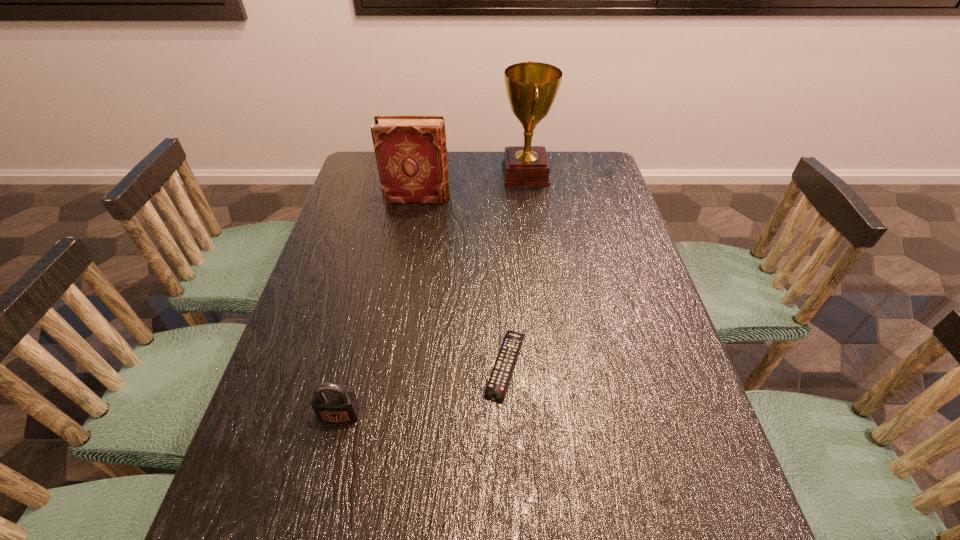
What are the coordinates of `free spot between the third farthest object and the padlock` in the screenshot? It's located at (422, 390).

Locate an element on the screen. This screenshot has height=540, width=960. empty space that is in between the second tallest object and the third farthest object is located at coordinates (462, 281).

The width and height of the screenshot is (960, 540). Find the location of `free spot between the nearest object and the shortest object`. free spot between the nearest object and the shortest object is located at coordinates (422, 390).

Where is `blank region between the award and the padlock`? This screenshot has height=540, width=960. blank region between the award and the padlock is located at coordinates (433, 294).

Where is `empty location between the hardback book and the shortest object`? This screenshot has height=540, width=960. empty location between the hardback book and the shortest object is located at coordinates (462, 281).

Identify the location of empty location between the remote control and the padlock. The image size is (960, 540). (422, 390).

I want to click on blank region between the padlock and the hardback book, so click(x=378, y=307).

You are a GUI agent. You are given a task and a screenshot of the screen. Output one action in this format:
    pyautogui.click(x=<x>, y=<y>)
    Task: Click on the vacant point located between the tallest object and the padlock
    
    Given the screenshot: What is the action you would take?
    pyautogui.click(x=433, y=294)

What are the coordinates of `free space between the third shortest object and the tallest object` in the screenshot? It's located at (471, 186).

Locate an element on the screen. free space between the hardback book and the tallest object is located at coordinates (471, 186).